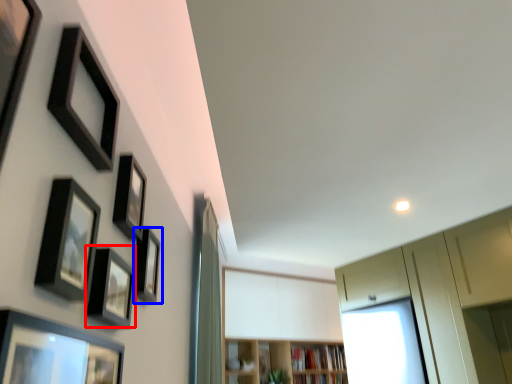
Question: Which object is further to the camera taking this photo, picture frame (highlighted by a red box) or picture frame (highlighted by a blue box)?

Choices:
 (A) picture frame
 (B) picture frame

Answer: (B)